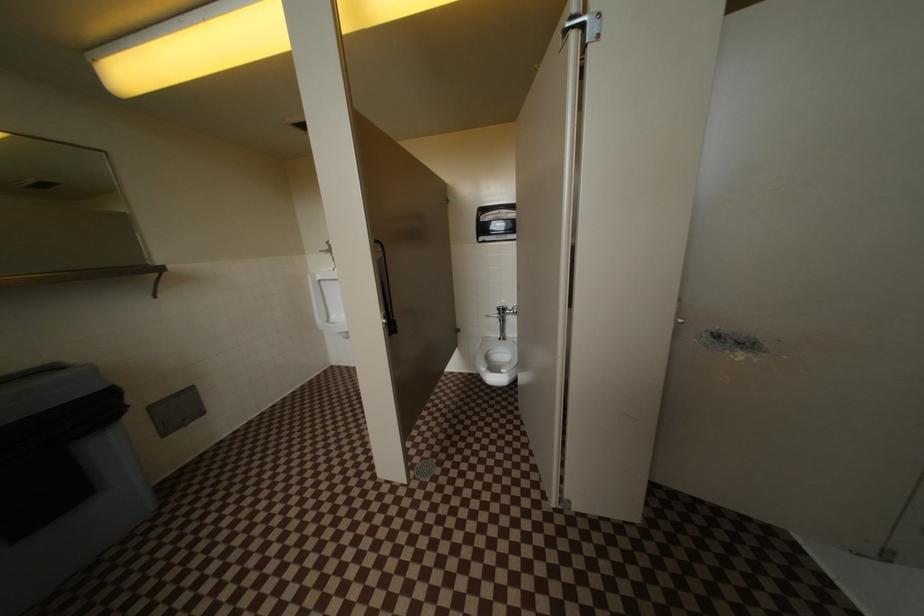
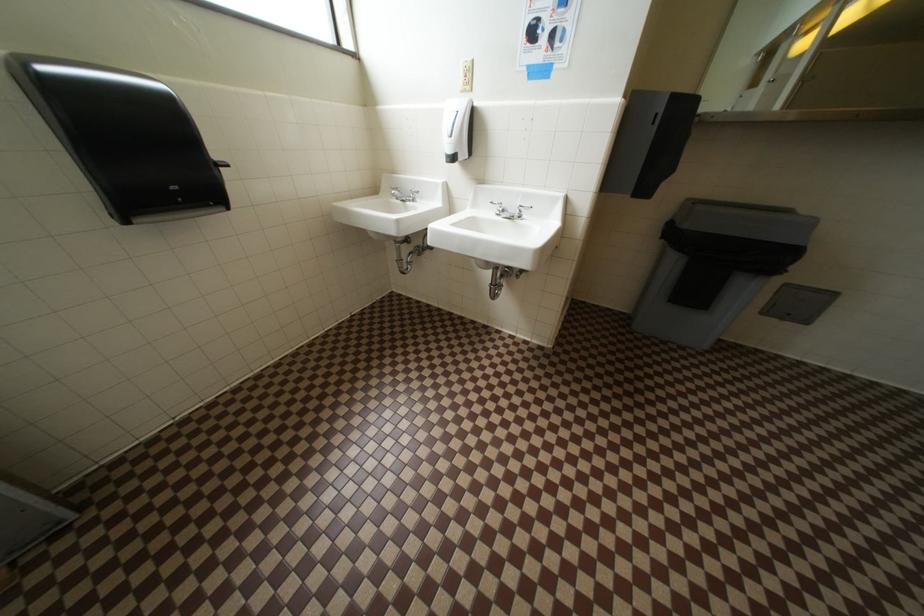
How did the camera likely rotate?

The camera's rotation is toward left-down.